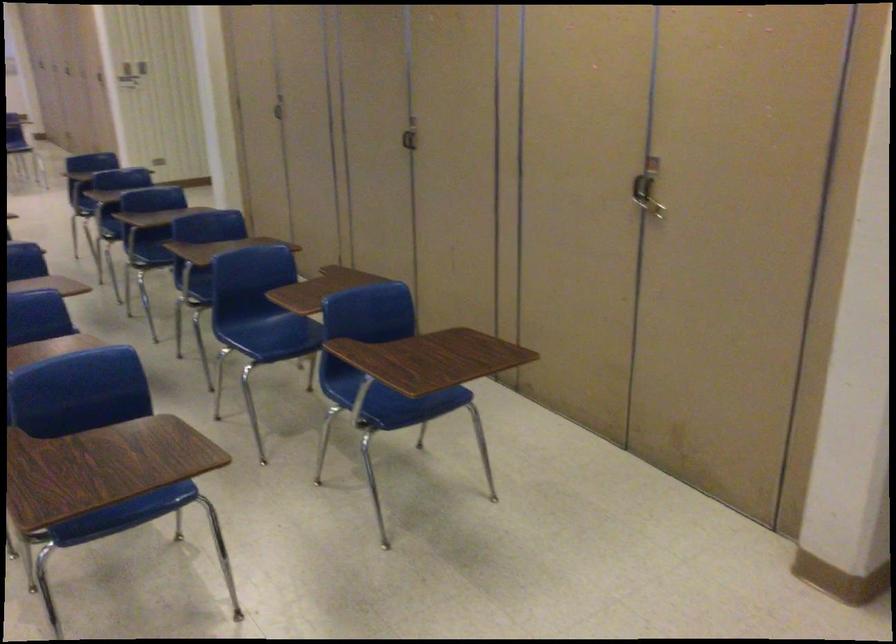
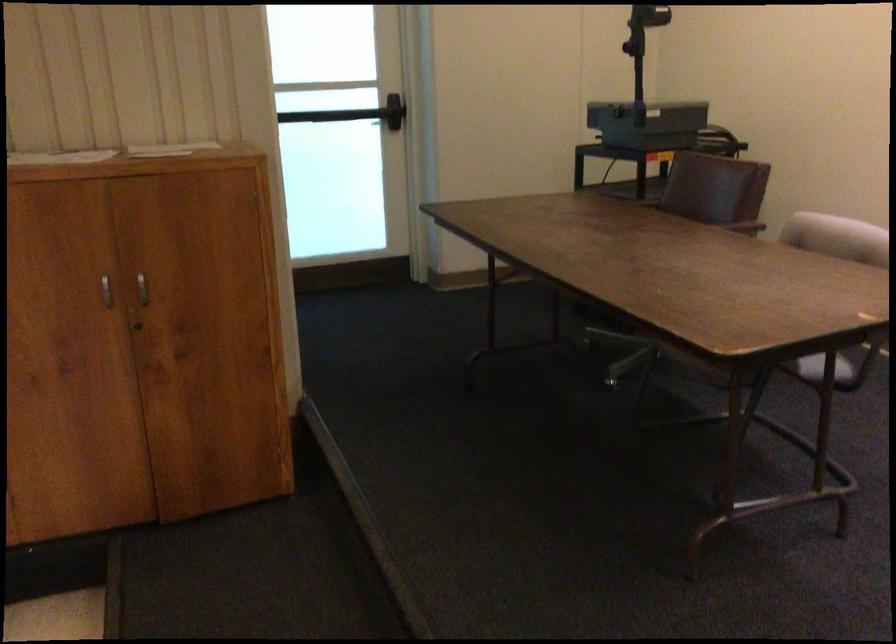
Question: The camera is either moving clockwise (left) or counter-clockwise (right) around the object. The first image is from the beginning of the video and the second image is from the end. Is the camera moving left or right when shooting the video?

Choices:
 (A) Left
 (B) Right

Answer: (A)